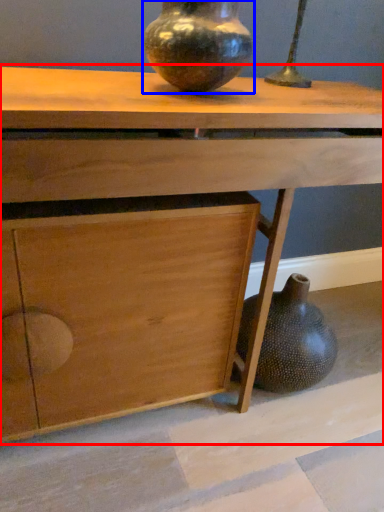
Question: Which object is closer to the camera taking this photo, table (highlighted by a red box) or vase (highlighted by a blue box)?

Choices:
 (A) table
 (B) vase

Answer: (A)